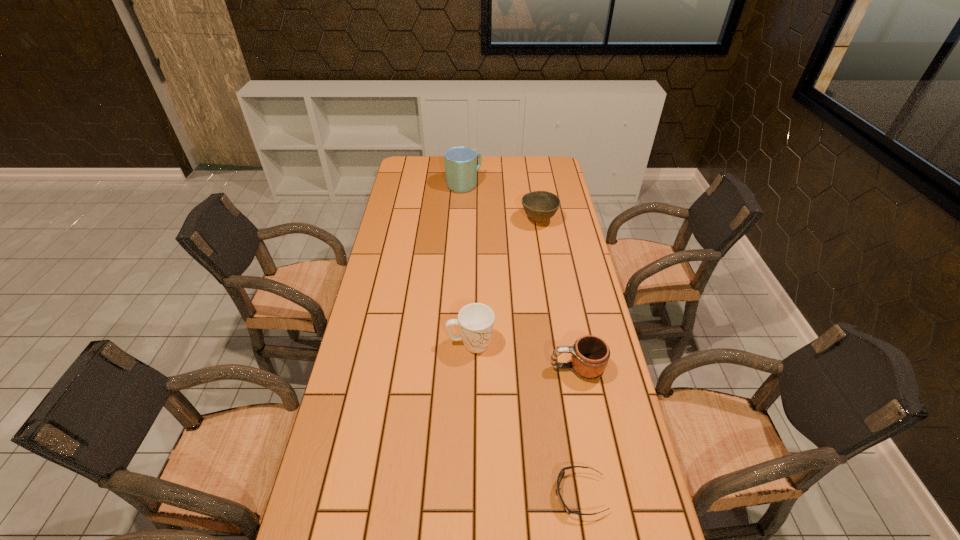
I want to click on free region located 0.350m on the side of the rightmost mug with the handle, so click(431, 368).

This screenshot has height=540, width=960. What are the coordinates of `vacant space situated 0.310m on the side of the rightmost mug with the handle` in the screenshot? It's located at (444, 368).

Where is `vacant space situated 0.290m on the side of the rightmost mug with the handle`? The width and height of the screenshot is (960, 540). vacant space situated 0.290m on the side of the rightmost mug with the handle is located at coordinates (451, 368).

Where is `vacant space located on the lenses of the nearest object`? vacant space located on the lenses of the nearest object is located at coordinates (433, 494).

You are a GUI agent. You are given a task and a screenshot of the screen. Output one action in this format:
    pyautogui.click(x=<x>, y=<y>)
    Task: Click on the vacant space located on the lenses of the nearest object
    The width and height of the screenshot is (960, 540).
    Given the screenshot: What is the action you would take?
    pyautogui.click(x=458, y=494)

At what (x,y) coordinates should I click in order to perform the action: click on vacant region located 0.120m on the lenses of the nearest object. Please return your answer as a coordinate pair (x, y). The image size is (960, 540). Looking at the image, I should click on (504, 494).

The width and height of the screenshot is (960, 540). I want to click on object that is at the far edge, so click(461, 167).

At what (x,y) coordinates should I click in order to perform the action: click on bowl situated at the right edge. Please return your answer as a coordinate pair (x, y). The width and height of the screenshot is (960, 540). Looking at the image, I should click on (540, 206).

At what (x,y) coordinates should I click in order to perform the action: click on mug at the right edge. Please return your answer as a coordinate pair (x, y). The height and width of the screenshot is (540, 960). Looking at the image, I should click on (590, 354).

Find the location of a particular element. The image size is (960, 540). goggles that is at the right edge is located at coordinates (562, 472).